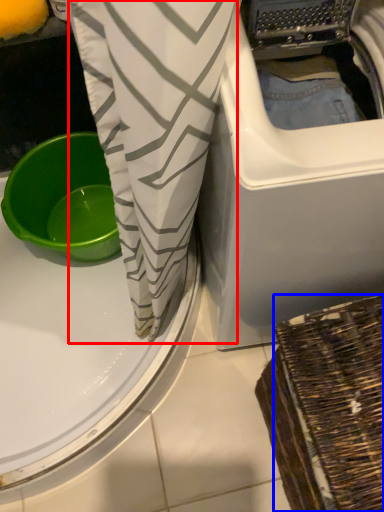
Question: Which point is further to the camera, clothing (highlighted by a red box) or basket (highlighted by a blue box)?

Choices:
 (A) clothing
 (B) basket

Answer: (A)